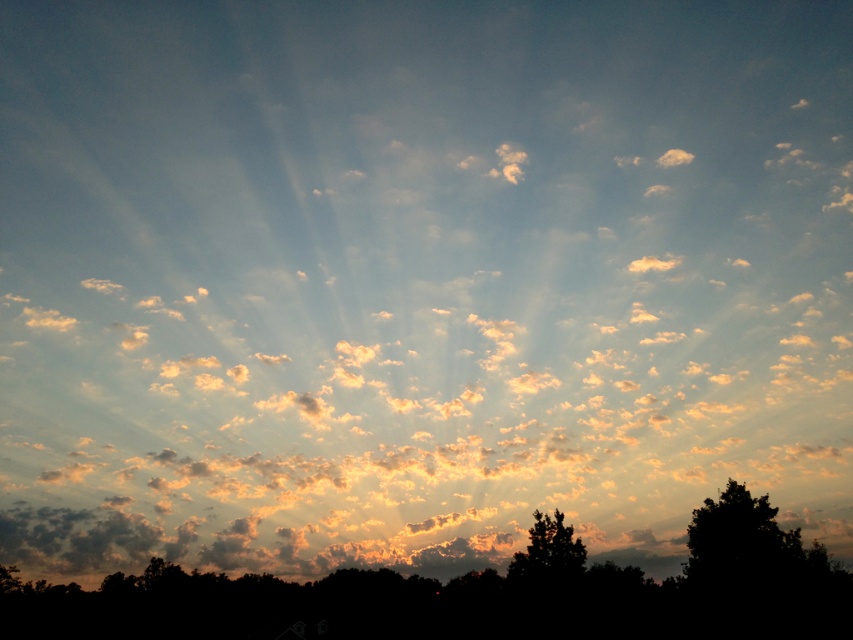
Is silhouette tree at lower center wider than silhouette tree at lower right?

Yes.

Describe the element at coordinates (477, 593) in the screenshot. This screenshot has height=640, width=853. I see `silhouette tree at lower center` at that location.

Locate an element on the screen. silhouette tree at lower center is located at coordinates (477, 593).